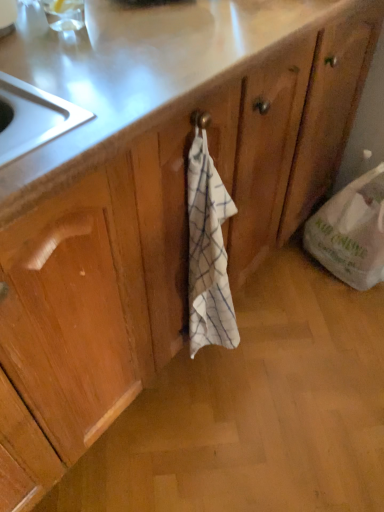
Where is `free space to the left of white plastic bag at lower right`? free space to the left of white plastic bag at lower right is located at coordinates (290, 273).